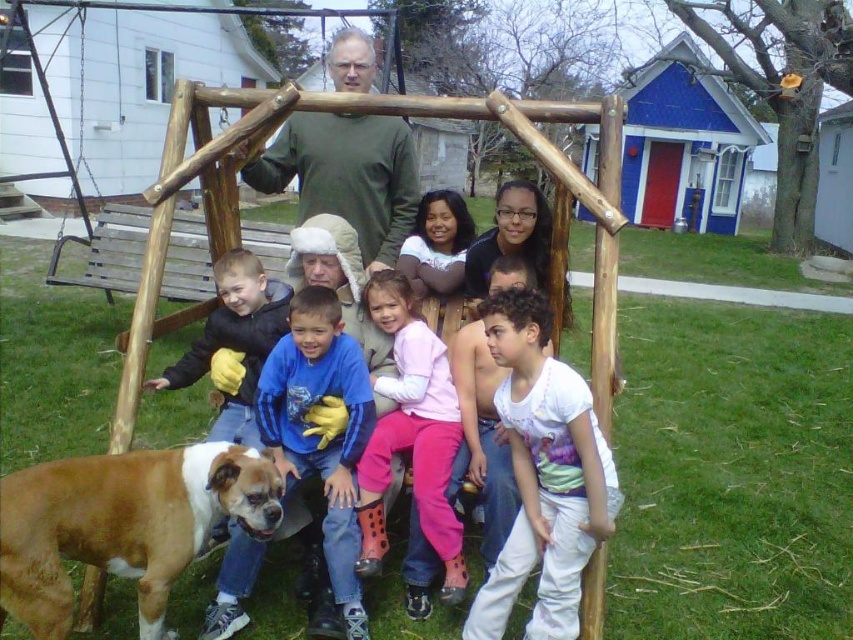
Does brown and white fur at lower left have a lesser height compared to white fur dog at lower left?

Yes, brown and white fur at lower left is shorter than white fur dog at lower left.

You are a GUI agent. You are given a task and a screenshot of the screen. Output one action in this format:
    pyautogui.click(x=<x>, y=<y>)
    Task: Click on the brown and white fur at lower left
    This screenshot has width=853, height=640.
    Given the screenshot: What is the action you would take?
    pyautogui.click(x=122, y=524)

Does point (42, 515) come farther from viewer compared to point (241, 436)?

No, (42, 515) is in front of (241, 436).

This screenshot has height=640, width=853. I want to click on brown and white fur at lower left, so click(x=122, y=524).

Consider the image. Can you confirm if brown and white fur at lower left is positioned to the right of green matte shirt at upper center?

No, brown and white fur at lower left is not to the right of green matte shirt at upper center.

Does brown and white fur at lower left appear on the left side of green matte shirt at upper center?

Yes, brown and white fur at lower left is to the left of green matte shirt at upper center.

Where is `brown and white fur at lower left`? The image size is (853, 640). brown and white fur at lower left is located at coordinates (122, 524).

This screenshot has width=853, height=640. I want to click on brown and white fur at lower left, so click(x=122, y=524).

Is point (300, 168) farther from camera compared to point (323, 410)?

That is True.

Does point (310, 208) come in front of point (247, 381)?

That is False.

Locate an element on the screen. green matte shirt at upper center is located at coordinates (346, 176).